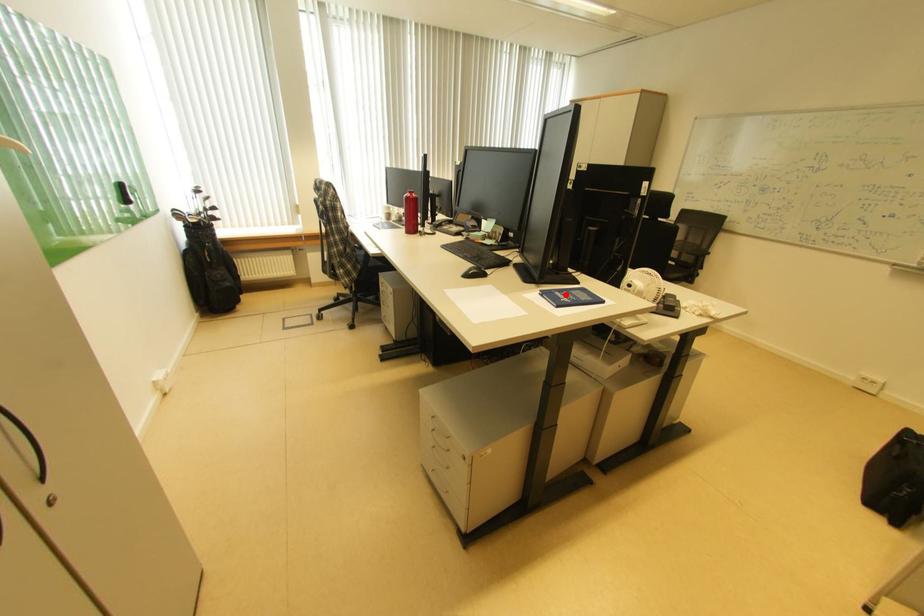
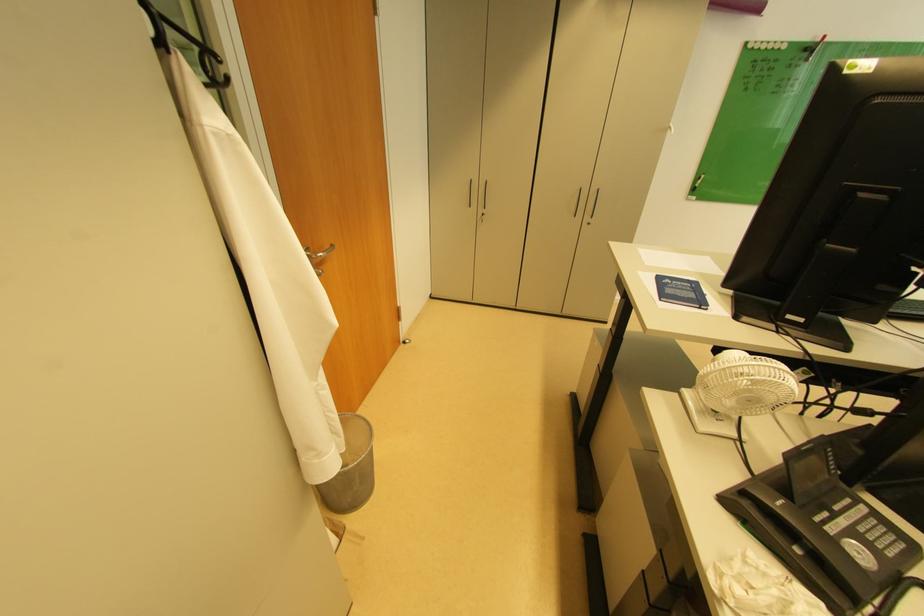
Locate, in the second image, the point that corresponds to the highlighted location in the first image.

(697, 286)